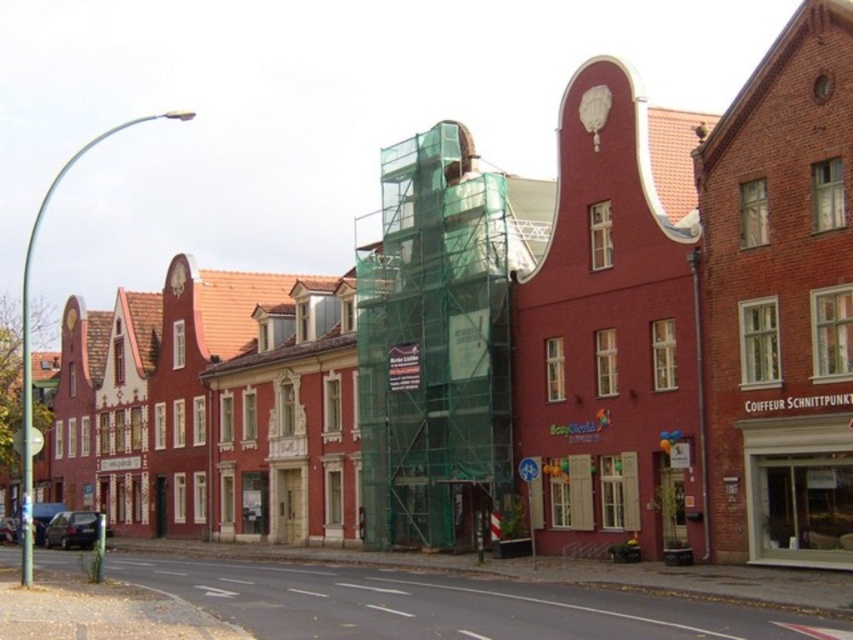
Question: Which point is farther to the camera?

Choices:
 (A) (631, 499)
 (B) (360, 422)

Answer: (B)

Question: Is matte red building at center above green mesh scaffolding at center?

Choices:
 (A) yes
 (B) no

Answer: (A)

Question: Which point is farther to the camera?

Choices:
 (A) matte red building at center
 (B) green mesh scaffolding at center

Answer: (B)

Question: Does matte red building at center have a smaller size compared to green mesh scaffolding at center?

Choices:
 (A) no
 (B) yes

Answer: (A)

Question: Can you confirm if matte red building at center is wider than green mesh scaffolding at center?

Choices:
 (A) no
 (B) yes

Answer: (B)